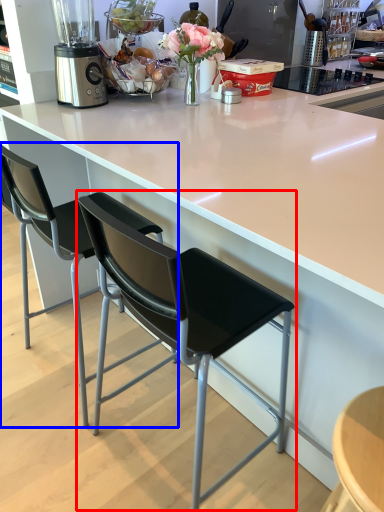
Question: Which point is further to the camera, chair (highlighted by a red box) or chair (highlighted by a blue box)?

Choices:
 (A) chair
 (B) chair

Answer: (B)